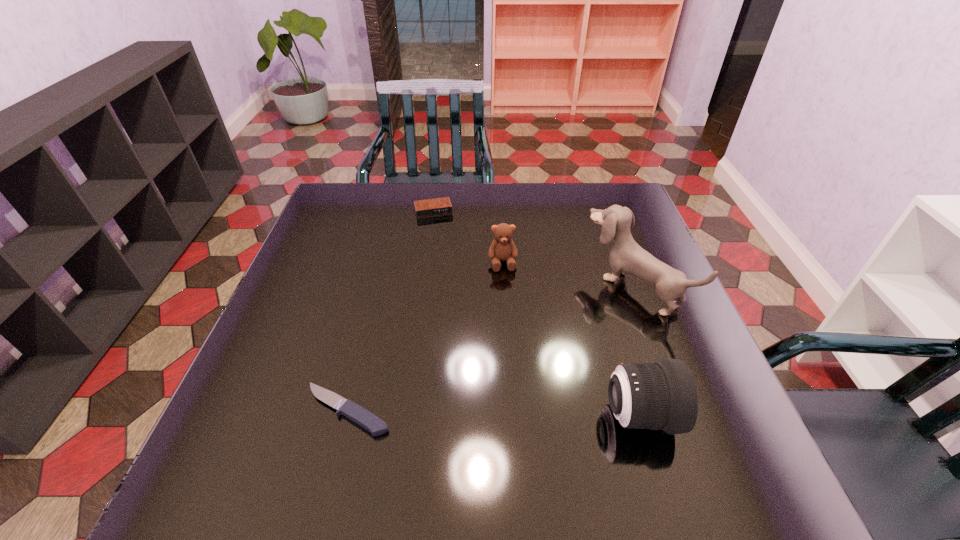
You are a GUI agent. You are given a task and a screenshot of the screen. Output one action in this format:
    pyautogui.click(x=<x>, y=<y>)
    Task: Click on the free spot between the steak knife and the second shortest object
    This screenshot has width=960, height=540.
    Given the screenshot: What is the action you would take?
    pyautogui.click(x=391, y=310)

Identify the location of free area in between the third object from right to left and the puppy. This screenshot has height=540, width=960. (567, 275).

Identify the location of the fourth closest object to the tallest object. 356,413.

Identify which object is located as the second nearest to the puppy. Please provide its 2D coordinates. Your answer should be formatted as a tuple, i.e. [(x, y)], where the tuple contains the x and y coordinates of a point satisfying the conditions above.

[(502, 248)]

Locate an element on the screen. This screenshot has width=960, height=540. free space that satisfies the following two spatial constraints: 1. on the front side of the alarm clock; 2. at the front element of the telephoto lens is located at coordinates (405, 415).

Identify the location of free space that satisfies the following two spatial constraints: 1. on the back side of the third shortest object; 2. on the left side of the shortest object. The height and width of the screenshot is (540, 960). (384, 262).

At what (x,y) coordinates should I click in order to perform the action: click on free spot that satisfies the following two spatial constraints: 1. on the back side of the teddy bear; 2. on the right side of the shortest object. Please return your answer as a coordinate pair (x, y). This screenshot has width=960, height=540. Looking at the image, I should click on (384, 262).

Where is `blank area in the image that satisfies the following two spatial constraints: 1. on the front side of the tallest object; 2. on the right side of the teddy bear`? blank area in the image that satisfies the following two spatial constraints: 1. on the front side of the tallest object; 2. on the right side of the teddy bear is located at coordinates (504, 287).